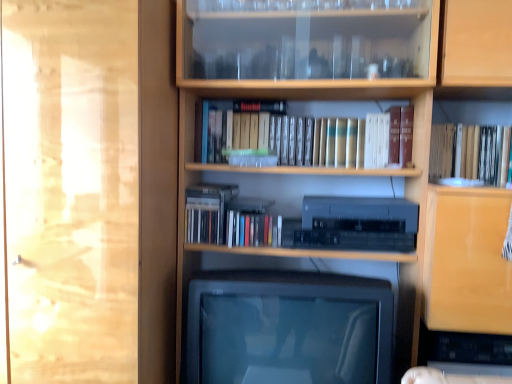
Question: Based on their sizes in the image, would you say wooden bookcase at center is bigger or smaller than transparent glass door at left?

Choices:
 (A) big
 (B) small

Answer: (A)

Question: From the image's perspective, is wooden bookcase at center located above or below transparent glass door at left?

Choices:
 (A) above
 (B) below

Answer: (A)

Question: Which is nearer to the transparent glass door at left?

Choices:
 (A) hardcover book at upper right
 (B) wooden bookcase at center
 (C) matte black television at center
 (D) satin black stereo at center

Answer: (C)

Question: Which object is positioned closest to the wooden bookcase at center?

Choices:
 (A) satin black stereo at center
 (B) matte black television at center
 (C) hardcover book at upper right
 (D) transparent glass door at left

Answer: (B)